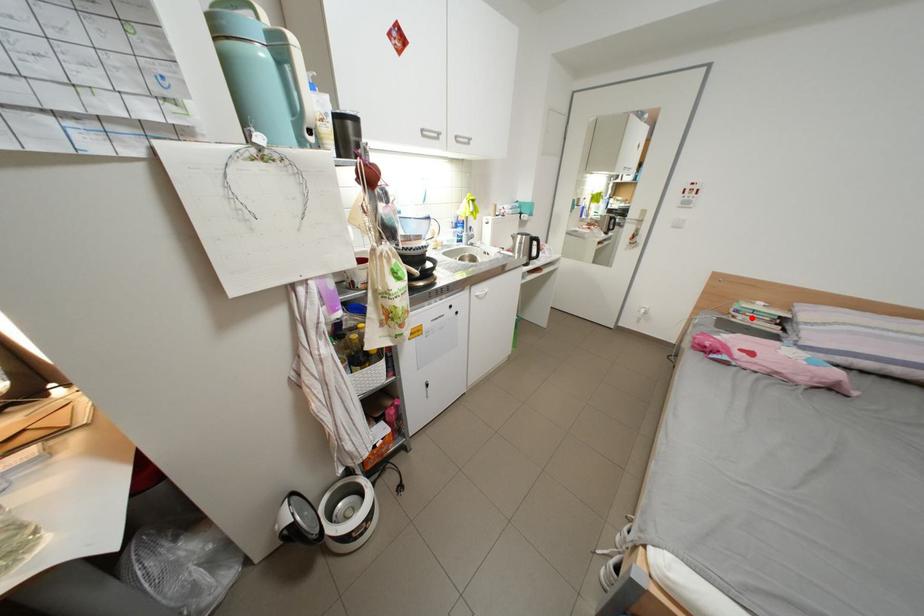
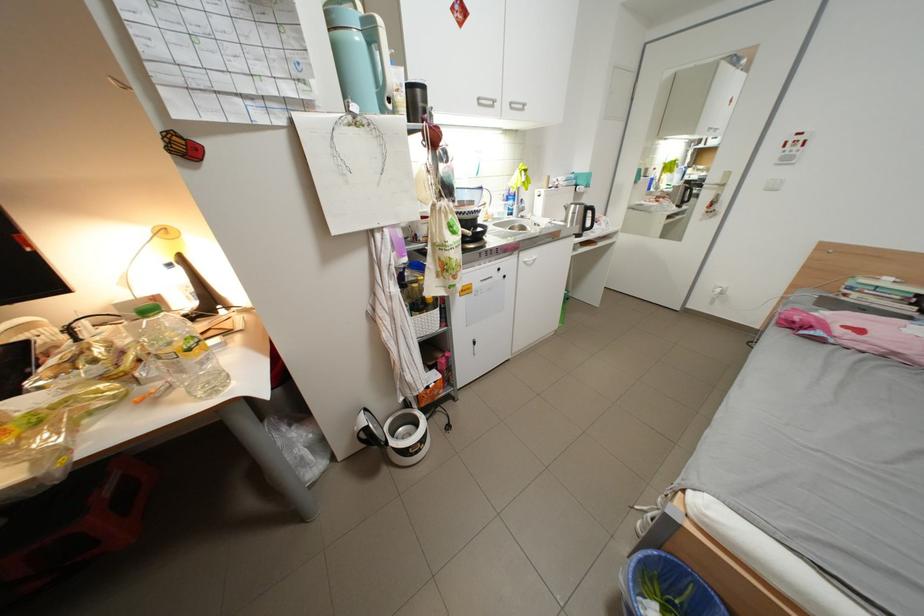
Question: I am providing you with two images of the same scene from different viewpoints. In image1, a red point is highlighted. Considering the same 3D point in image2, which of the following is correct?

Choices:
 (A) It is closer
 (B) It is farther

Answer: (B)